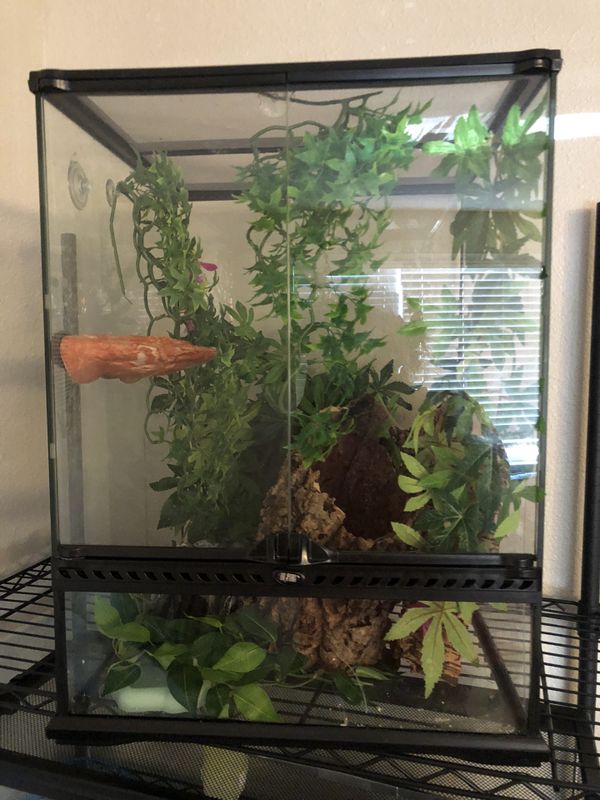
Locate an element on the screen. vent is located at coordinates (383, 580).